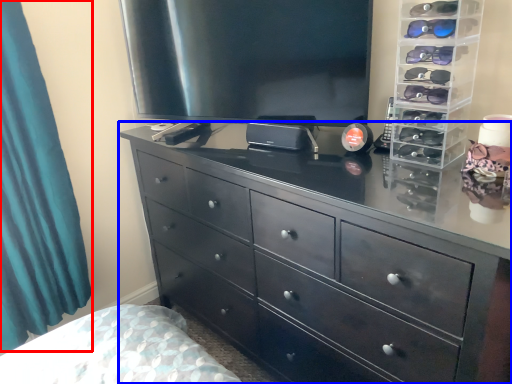
Question: Which point is closer to the camera, curtain (highlighted by a red box) or chest of drawers (highlighted by a blue box)?

Choices:
 (A) curtain
 (B) chest of drawers

Answer: (B)